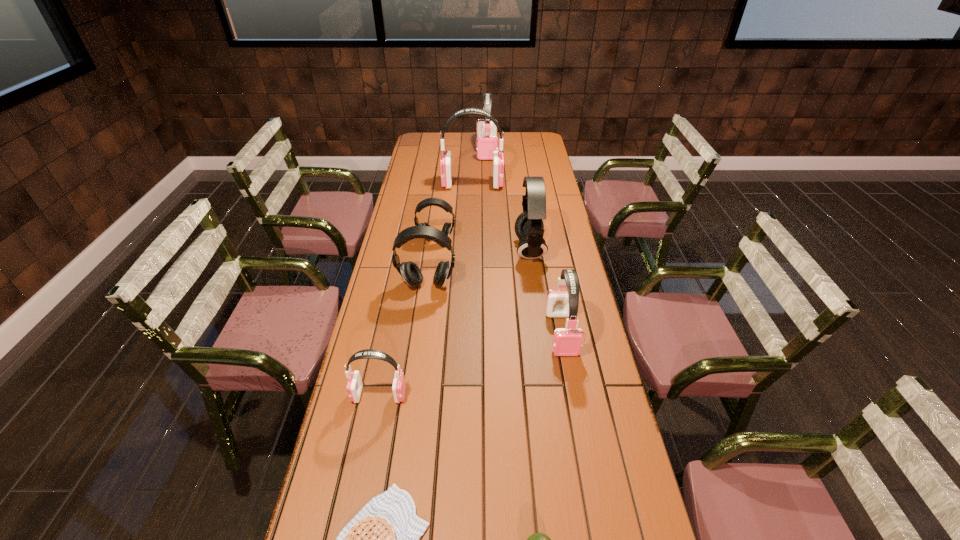
You are a GUI agent. You are given a task and a screenshot of the screen. Output one action in this format:
    pyautogui.click(x=<x>, y=<y>)
    Task: Click on the nearest earphone
    
    Given the screenshot: What is the action you would take?
    pyautogui.click(x=354, y=387)

Where is `the seventh farthest object`? This screenshot has height=540, width=960. the seventh farthest object is located at coordinates (354, 387).

Where is `vacant space located 0.090m on the outer surface of the biggest pink earphone`? vacant space located 0.090m on the outer surface of the biggest pink earphone is located at coordinates (521, 184).

Where is `vacant space positioned on the outer surface of the farthest object`? The image size is (960, 540). vacant space positioned on the outer surface of the farthest object is located at coordinates (488, 194).

What are the coordinates of `vacant space situated 0.260m on the ear cups of the biggest black earphone` in the screenshot? It's located at (448, 250).

Identify the location of blank area located 0.200m on the ear cups of the biggest black earphone. The width and height of the screenshot is (960, 540). (464, 250).

Image resolution: width=960 pixels, height=540 pixels. I want to click on blank space located on the ear cups of the biggest black earphone, so click(459, 250).

You are a GUI agent. You are given a task and a screenshot of the screen. Output one action in this format:
    pyautogui.click(x=<x>, y=<y>)
    Task: Click on the free spot located on the ear cups of the third nearest earphone
    
    Given the screenshot: What is the action you would take?
    pyautogui.click(x=424, y=304)

At what (x,y) coordinates should I click in order to perform the action: click on vacant area situated 0.400m on the outer surface of the rightmost pink earphone. Please return your answer as a coordinate pair (x, y). This screenshot has width=960, height=540. Looking at the image, I should click on (591, 493).

Locate an element on the screen. This screenshot has width=960, height=540. free region located 0.140m on the ear cups of the smallest black earphone is located at coordinates click(x=433, y=266).